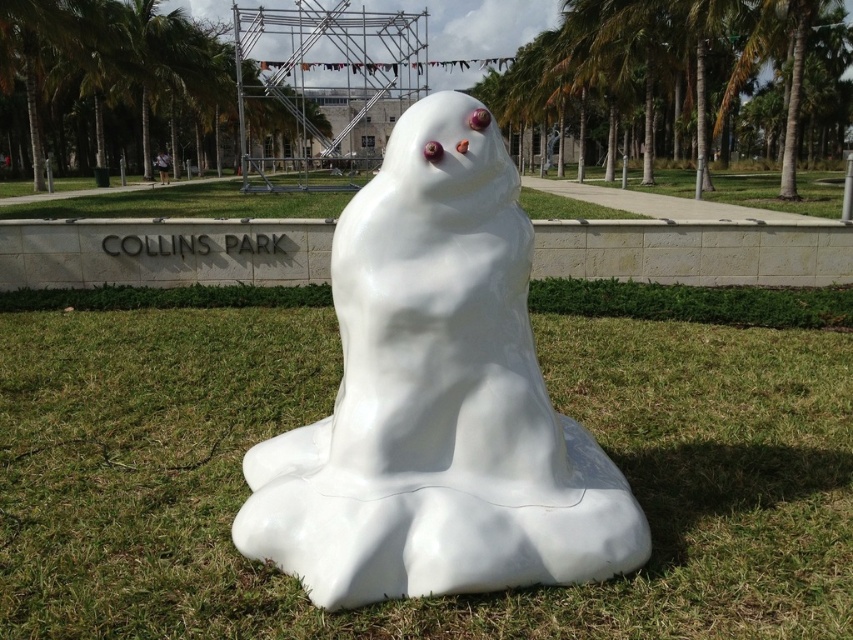
Question: Can you confirm if white grass at center is thinner than white glossy ghost at center?

Choices:
 (A) no
 (B) yes

Answer: (B)

Question: Does white grass at center appear over white glossy ghost at center?

Choices:
 (A) no
 (B) yes

Answer: (A)

Question: Which object is closer to the camera taking this photo?

Choices:
 (A) white glossy ghost at center
 (B) white grass at center

Answer: (A)

Question: Is white grass at center wider than white glossy ghost at center?

Choices:
 (A) no
 (B) yes

Answer: (A)